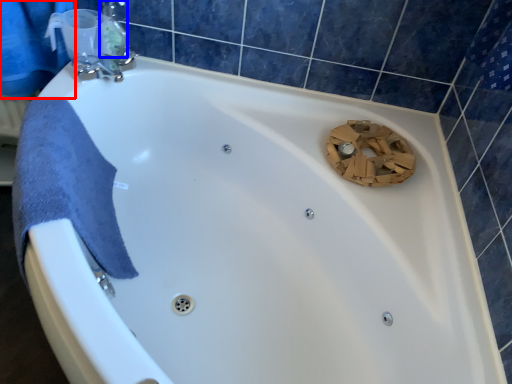
Question: Which of the following is the farthest to the observer, shower curtain (highlighted by a red box) or toiletry (highlighted by a blue box)?

Choices:
 (A) shower curtain
 (B) toiletry

Answer: (B)